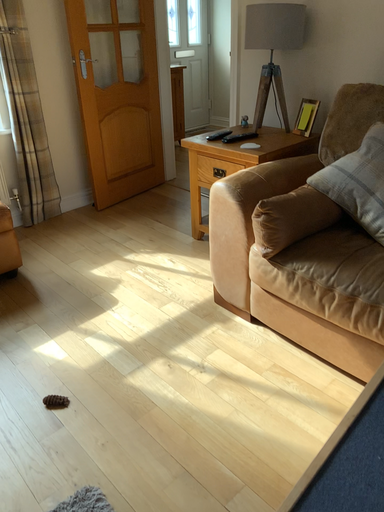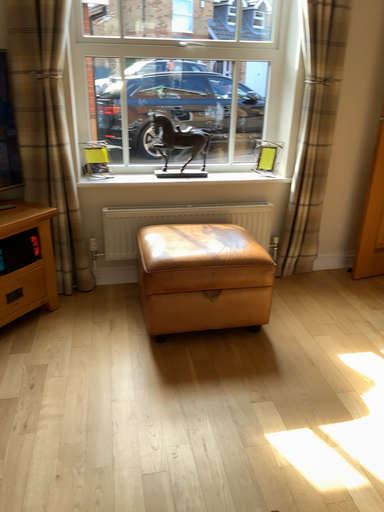
Question: How did the camera likely rotate when shooting the video?

Choices:
 (A) rotated right
 (B) rotated left

Answer: (B)